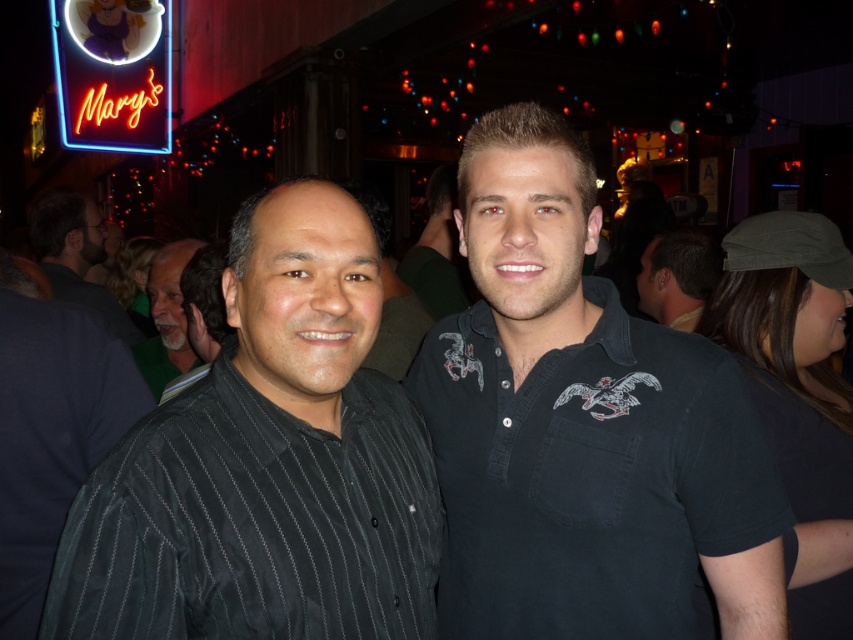
Question: Is black pinstriped shirt at center bigger than gray striped shirt at left?

Choices:
 (A) no
 (B) yes

Answer: (A)

Question: Where is black cotton polo shirt at right located in relation to black matte shirt at center in the image?

Choices:
 (A) right
 (B) left

Answer: (A)

Question: Which object is farther from the camera taking this photo?

Choices:
 (A) dark blue shirt at left
 (B) dark green fabric cap at upper right
 (C) matte black shirt at center

Answer: (A)

Question: Is dark green fabric cap at upper right bigger than black matte shirt at center?

Choices:
 (A) no
 (B) yes

Answer: (A)

Question: Which object is farther from the camera taking this photo?

Choices:
 (A) black matte shirt at center
 (B) neon sign at upper left
 (C) dark blue shirt at left

Answer: (B)

Question: Which object is farther from the camera taking this photo?

Choices:
 (A) matte black shirt at center
 (B) black cotton polo shirt at right
 (C) black pinstriped shirt at center

Answer: (A)